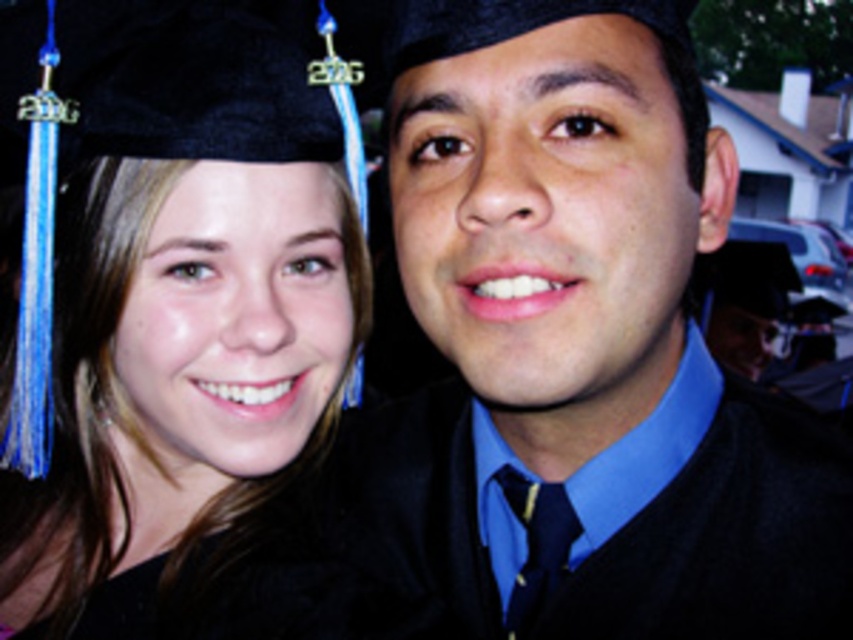
You are taking a photo of two graduates wearing their caps. You notice both have a matte black graduation cap at upper left and a black matte graduation cap at upper left. Which one is positioned lower?

The matte black graduation cap at upper left is positioned lower than the black matte graduation cap at upper left.

You are standing in front of the two graduates. There are two points marked in the image. The first point is at coordinates point (79,186) and the second point is at point (761,474). Which point is closer to you?

Point (79,186) is behind point (761,474), so the point closer to you is point (761,474).

Looking at this image, you are standing in front of a graduation photo and want to locate the matte black graduation cap at upper left. According to the coordinates provided, where exactly is it positioned?

The matte black graduation cap at upper left is positioned at coordinates point (x=576, y=339).